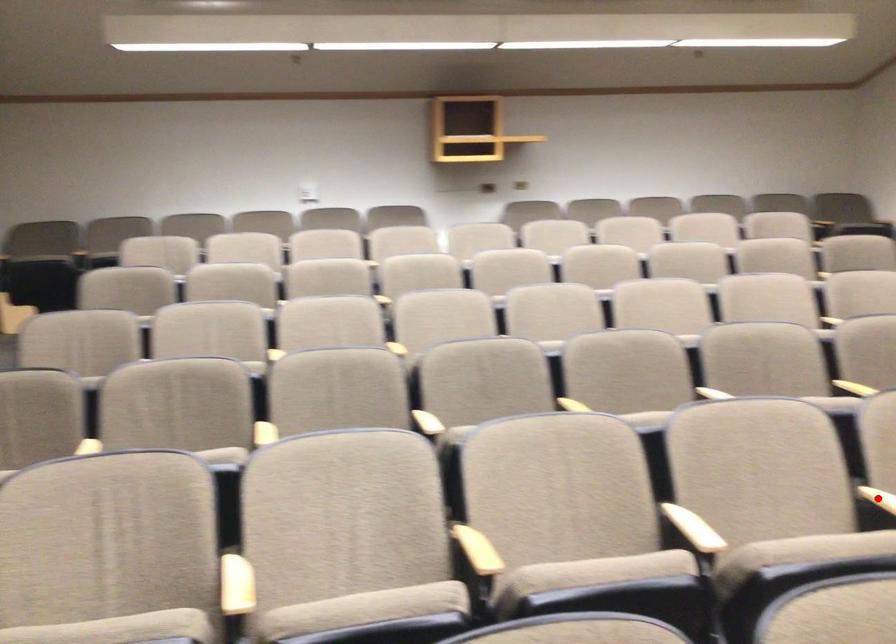
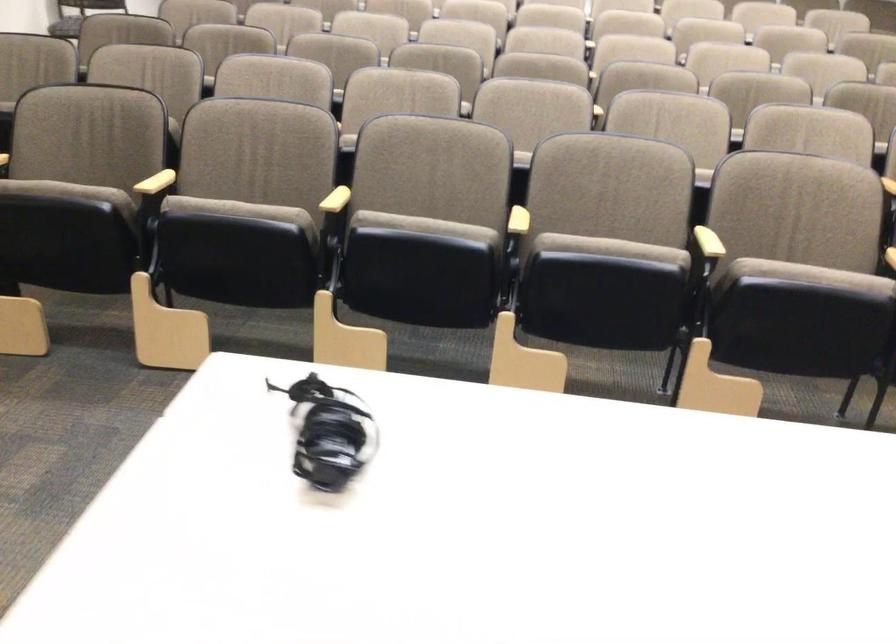
Question: I am providing you with two images of the same scene from different viewpoints. A red point is marked on the first image. Can you still see the location of the red point in image 2?

Choices:
 (A) Yes
 (B) No

Answer: (B)